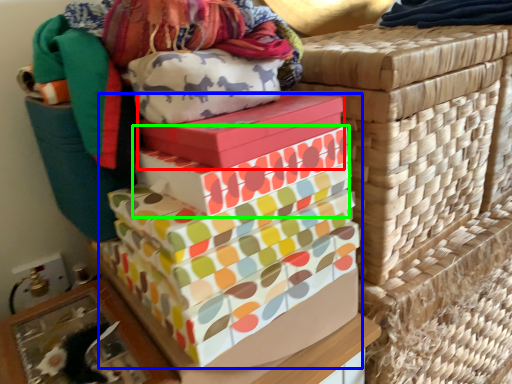
Question: Estimate the real-world distances between objects in this image. Which object is closer to gift box (highlighted by a red box), gift box (highlighted by a blue box) or gift box (highlighted by a green box)?

Choices:
 (A) gift box
 (B) gift box

Answer: (B)